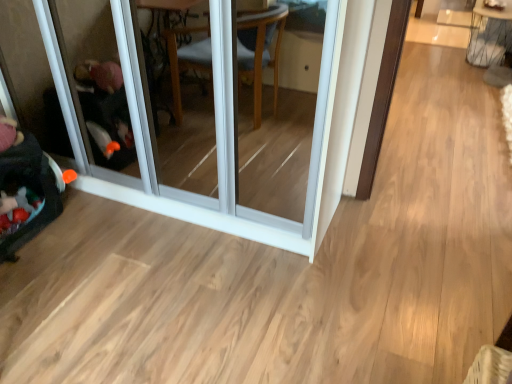
Question: Does velvet black baby carriage at left come in front of metallic wire table at upper right?

Choices:
 (A) yes
 (B) no

Answer: (A)

Question: Is velvet black baby carriage at left to the right of metallic wire table at upper right from the viewer's perspective?

Choices:
 (A) yes
 (B) no

Answer: (B)

Question: Is velvet black baby carriage at left turned away from metallic wire table at upper right?

Choices:
 (A) yes
 (B) no

Answer: (B)

Question: Considering the relative sizes of velvet black baby carriage at left and metallic wire table at upper right in the image provided, is velvet black baby carriage at left taller than metallic wire table at upper right?

Choices:
 (A) yes
 (B) no

Answer: (B)

Question: From a real-world perspective, is velvet black baby carriage at left physically below metallic wire table at upper right?

Choices:
 (A) no
 (B) yes

Answer: (B)

Question: Considering the relative sizes of velvet black baby carriage at left and metallic wire table at upper right in the image provided, is velvet black baby carriage at left thinner than metallic wire table at upper right?

Choices:
 (A) no
 (B) yes

Answer: (B)

Question: Is metallic wire table at upper right touching transparent glass screen door at left?

Choices:
 (A) no
 (B) yes

Answer: (A)

Question: From the image's perspective, is metallic wire table at upper right above transparent glass screen door at left?

Choices:
 (A) yes
 (B) no

Answer: (A)

Question: Is metallic wire table at upper right wider than transparent glass screen door at left?

Choices:
 (A) no
 (B) yes

Answer: (A)

Question: Is metallic wire table at upper right shorter than transparent glass screen door at left?

Choices:
 (A) no
 (B) yes

Answer: (B)

Question: Does metallic wire table at upper right have a larger size compared to transparent glass screen door at left?

Choices:
 (A) no
 (B) yes

Answer: (A)

Question: Considering the relative sizes of metallic wire table at upper right and transparent glass screen door at left in the image provided, is metallic wire table at upper right taller than transparent glass screen door at left?

Choices:
 (A) yes
 (B) no

Answer: (B)

Question: From the image's perspective, is velvet black baby carriage at left under transparent glass screen door at left?

Choices:
 (A) no
 (B) yes

Answer: (B)